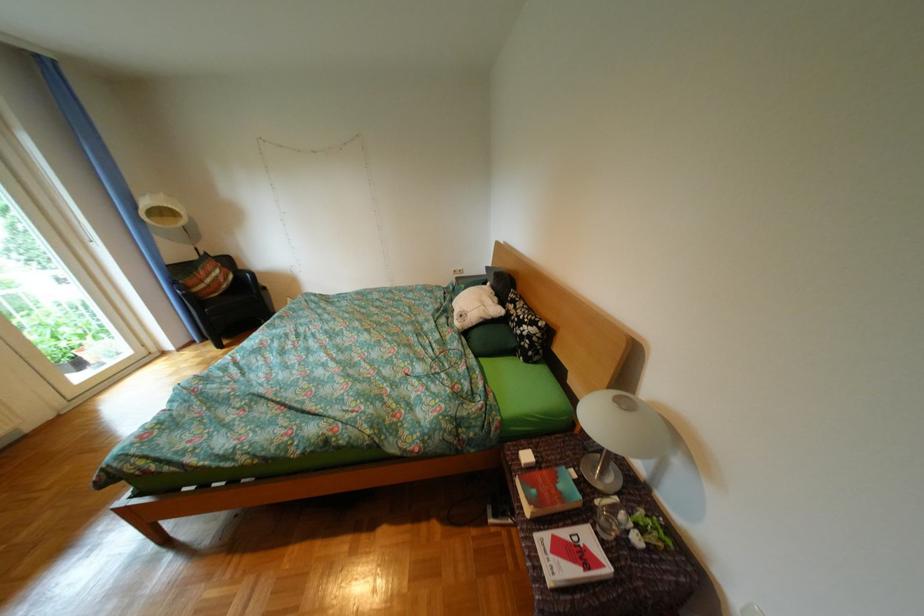
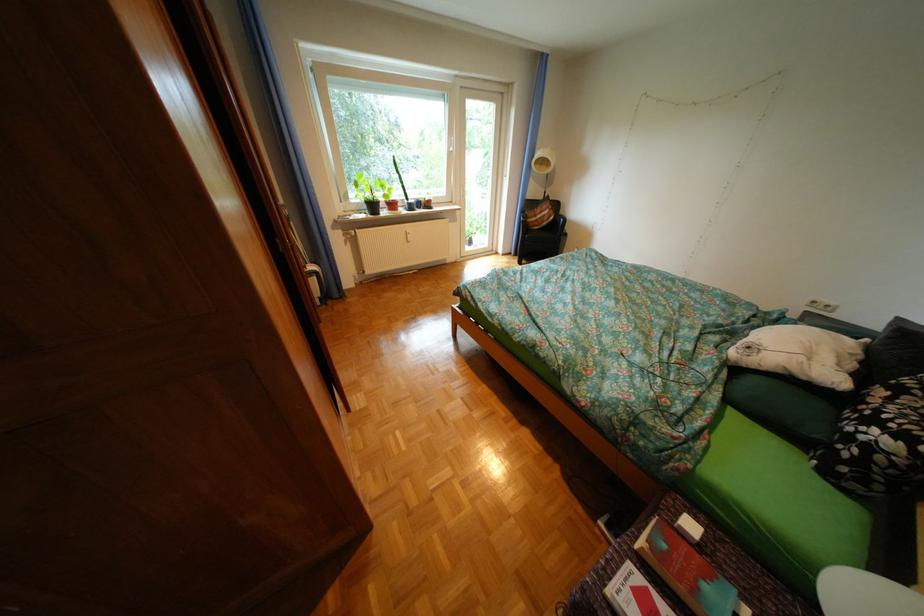
In the second image, find the point that corresponds to (476,315) in the first image.

(763, 349)